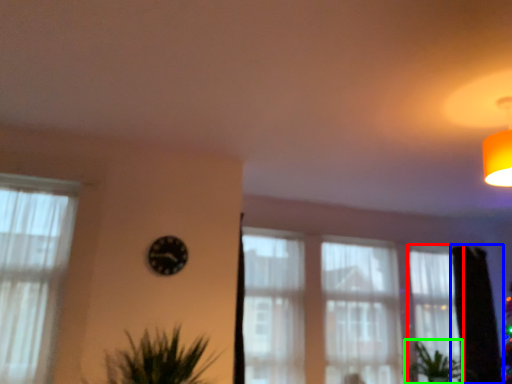
Question: Estimate the real-world distances between objects in this image. Which object is farther from curtain (highlighted by a red box), tree (highlighted by a blue box) or plant (highlighted by a green box)?

Choices:
 (A) tree
 (B) plant

Answer: (B)